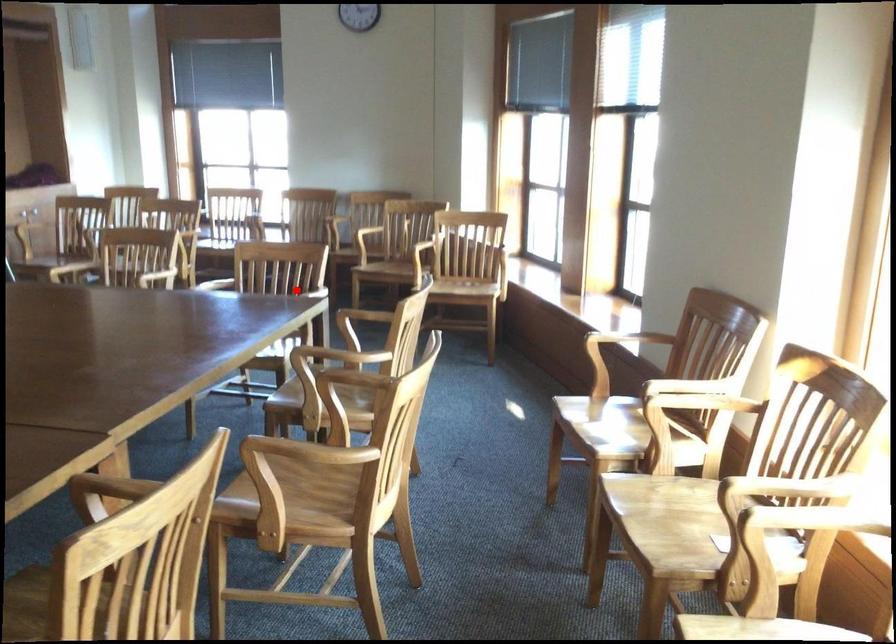
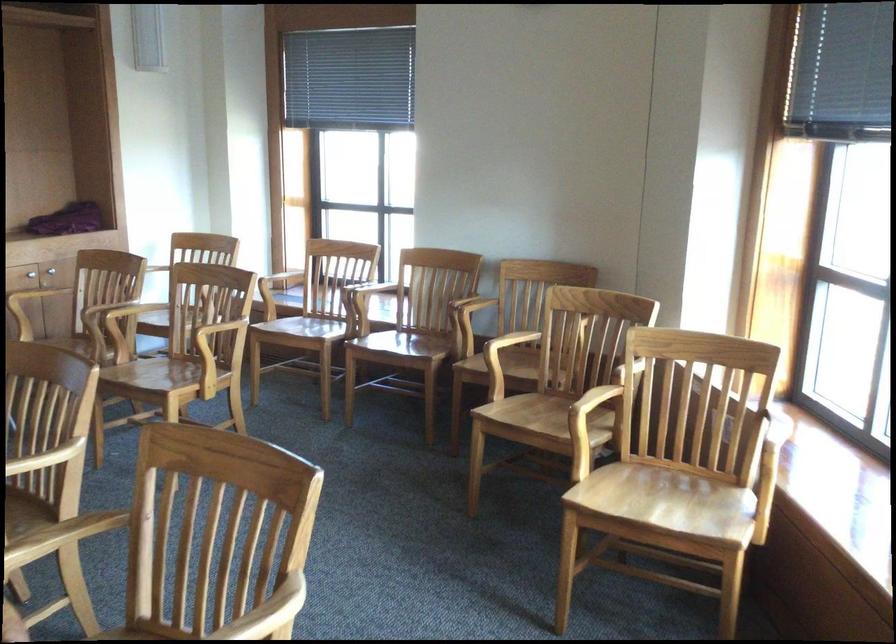
Question: A red point is marked in image1. In image2, is the corresponding 3D point closer to the camera or farther? Reply with the corresponding letter.

Choices:
 (A) The corresponding 3D point is closer.
 (B) The corresponding 3D point is farther.

Answer: (A)